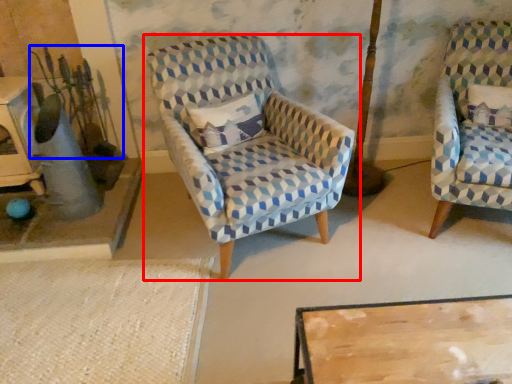
Question: Which point is closer to the camera, chair (highlighted by a red box) or plant (highlighted by a blue box)?

Choices:
 (A) chair
 (B) plant

Answer: (A)